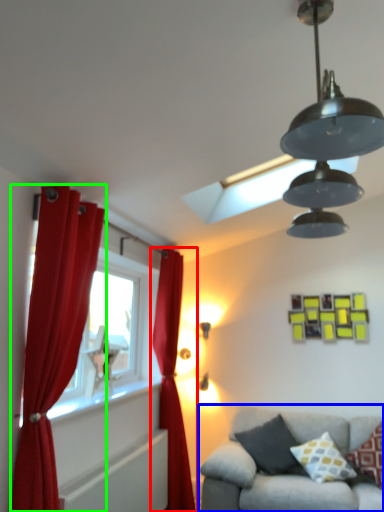
Question: Which is farther away from curtain (highlighted by a red box)? studio couch (highlighted by a blue box) or curtain (highlighted by a green box)?

Choices:
 (A) studio couch
 (B) curtain

Answer: (B)